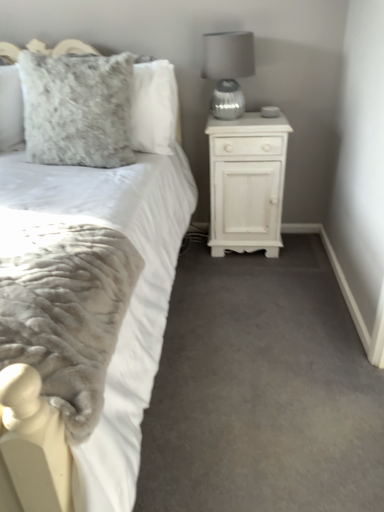
Question: From the image's perspective, is satin silver lamp at upper right on fuzzy gray pillow at upper left?

Choices:
 (A) yes
 (B) no

Answer: (A)

Question: From a real-world perspective, is satin silver lamp at upper right physically above fuzzy gray pillow at upper left?

Choices:
 (A) no
 (B) yes

Answer: (B)

Question: Is fuzzy gray pillow at upper left at the back of satin silver lamp at upper right?

Choices:
 (A) yes
 (B) no

Answer: (B)

Question: Considering the relative positions of satin silver lamp at upper right and fuzzy gray pillow at upper left in the image provided, is satin silver lamp at upper right to the left of fuzzy gray pillow at upper left from the viewer's perspective?

Choices:
 (A) yes
 (B) no

Answer: (B)

Question: Is satin silver lamp at upper right not inside fuzzy gray pillow at upper left?

Choices:
 (A) no
 (B) yes

Answer: (B)

Question: In terms of height, does white wood nightstand at right look taller or shorter compared to satin silver lamp at upper right?

Choices:
 (A) short
 (B) tall

Answer: (B)

Question: From the image's perspective, is white wood nightstand at right above or below satin silver lamp at upper right?

Choices:
 (A) above
 (B) below

Answer: (B)

Question: In the image, is white wood nightstand at right on the left side or the right side of satin silver lamp at upper right?

Choices:
 (A) right
 (B) left

Answer: (A)

Question: Considering the positions of white wood nightstand at right and satin silver lamp at upper right in the image, is white wood nightstand at right wider or thinner than satin silver lamp at upper right?

Choices:
 (A) wide
 (B) thin

Answer: (A)

Question: Looking at their shapes, would you say satin silver lamp at upper right is wider or thinner than white plush bed at center?

Choices:
 (A) wide
 (B) thin

Answer: (B)

Question: From a real-world perspective, relative to white plush bed at center, is satin silver lamp at upper right vertically above or below?

Choices:
 (A) above
 (B) below

Answer: (A)

Question: From the image's perspective, relative to white plush bed at center, is satin silver lamp at upper right above or below?

Choices:
 (A) above
 (B) below

Answer: (A)

Question: Which is correct: satin silver lamp at upper right is inside white plush bed at center, or outside of it?

Choices:
 (A) outside
 (B) inside

Answer: (A)

Question: From the image's perspective, relative to satin silver lamp at upper right, is fuzzy gray pillow at upper left above or below?

Choices:
 (A) below
 (B) above

Answer: (A)

Question: Considering the positions of fuzzy gray pillow at upper left and satin silver lamp at upper right in the image, is fuzzy gray pillow at upper left taller or shorter than satin silver lamp at upper right?

Choices:
 (A) short
 (B) tall

Answer: (B)